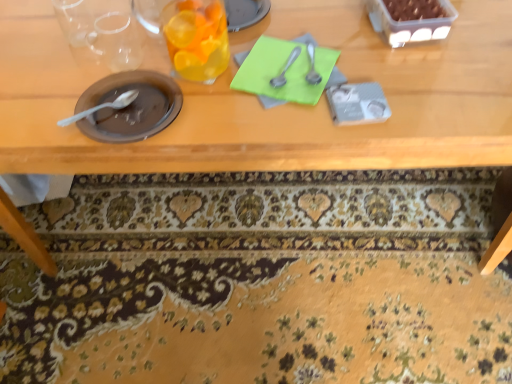
In order to click on vacant space in front of green paper at center in this screenshot , I will do `click(288, 133)`.